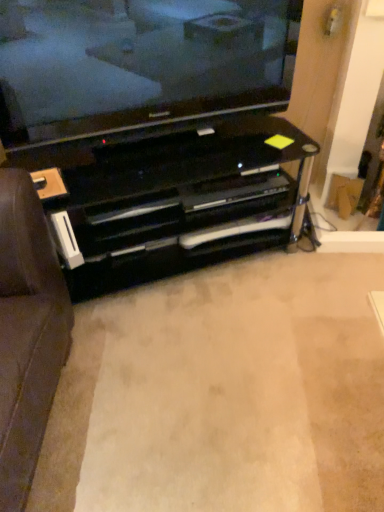
The width and height of the screenshot is (384, 512). In order to click on free space above black glossy tv stand at center (from a real-world perspective) in this screenshot , I will do `click(245, 334)`.